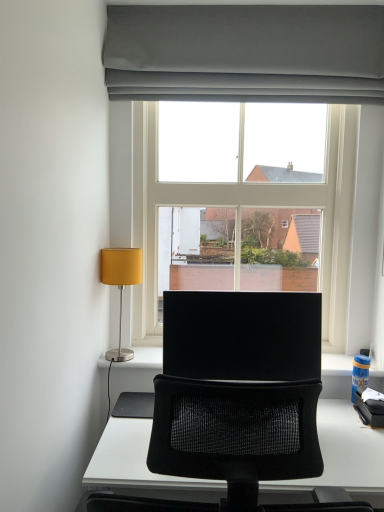
Question: Is matte gray curtain at upper center at the right side of clear glass window at center?

Choices:
 (A) yes
 (B) no

Answer: (B)

Question: Does matte gray curtain at upper center have a greater height compared to clear glass window at center?

Choices:
 (A) yes
 (B) no

Answer: (B)

Question: Can you confirm if matte gray curtain at upper center is positioned to the left of clear glass window at center?

Choices:
 (A) no
 (B) yes

Answer: (B)

Question: Does matte gray curtain at upper center have a greater width compared to clear glass window at center?

Choices:
 (A) no
 (B) yes

Answer: (A)

Question: Is matte gray curtain at upper center beside clear glass window at center?

Choices:
 (A) yes
 (B) no

Answer: (A)

Question: Looking at the image, does matte yellow fabric lampshade at left seem bigger or smaller compared to matte gray curtain at upper center?

Choices:
 (A) small
 (B) big

Answer: (A)

Question: Considering their positions, is matte yellow fabric lampshade at left located in front of or behind matte gray curtain at upper center?

Choices:
 (A) behind
 (B) front

Answer: (A)

Question: Looking at their shapes, would you say matte yellow fabric lampshade at left is wider or thinner than matte gray curtain at upper center?

Choices:
 (A) thin
 (B) wide

Answer: (B)

Question: From a real-world perspective, is matte yellow fabric lampshade at left positioned above or below matte gray curtain at upper center?

Choices:
 (A) above
 (B) below

Answer: (B)

Question: From a real-world perspective, is matte yellow fabric lampshade at left positioned above or below clear glass window at center?

Choices:
 (A) above
 (B) below

Answer: (B)

Question: Is matte yellow fabric lampshade at left taller or shorter than clear glass window at center?

Choices:
 (A) short
 (B) tall

Answer: (A)

Question: Considering the positions of point (120, 357) and point (339, 74), is point (120, 357) closer or farther from the camera than point (339, 74)?

Choices:
 (A) closer
 (B) farther

Answer: (B)

Question: Relative to clear glass window at center, is matte yellow fabric lampshade at left in front or behind?

Choices:
 (A) behind
 (B) front

Answer: (B)

Question: Is clear glass window at center inside or outside of matte yellow fabric lampshade at left?

Choices:
 (A) outside
 (B) inside

Answer: (A)

Question: From the image's perspective, is clear glass window at center positioned above or below matte yellow fabric lampshade at left?

Choices:
 (A) below
 (B) above

Answer: (B)